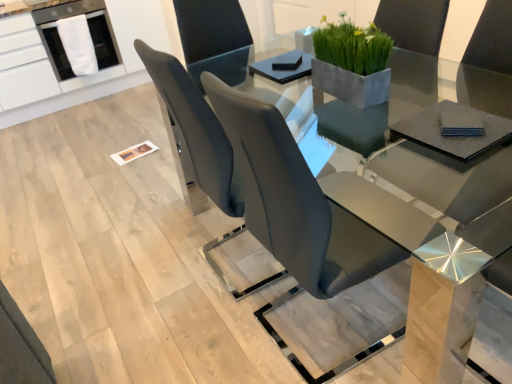
Locate an element on the screen. vacant space to the left of matte gray chair at center, marked as the first chair in a left-to-right arrangement is located at coordinates (152, 271).